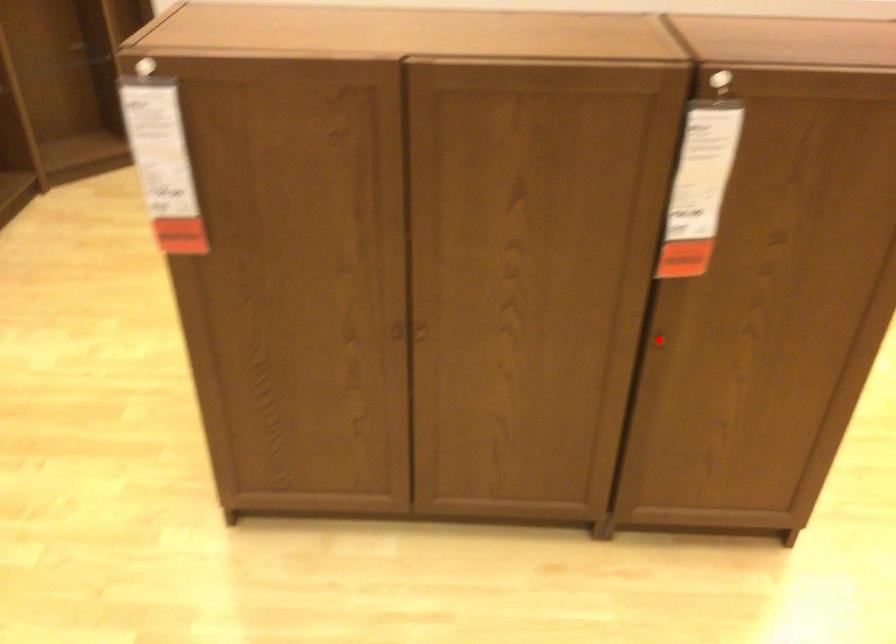
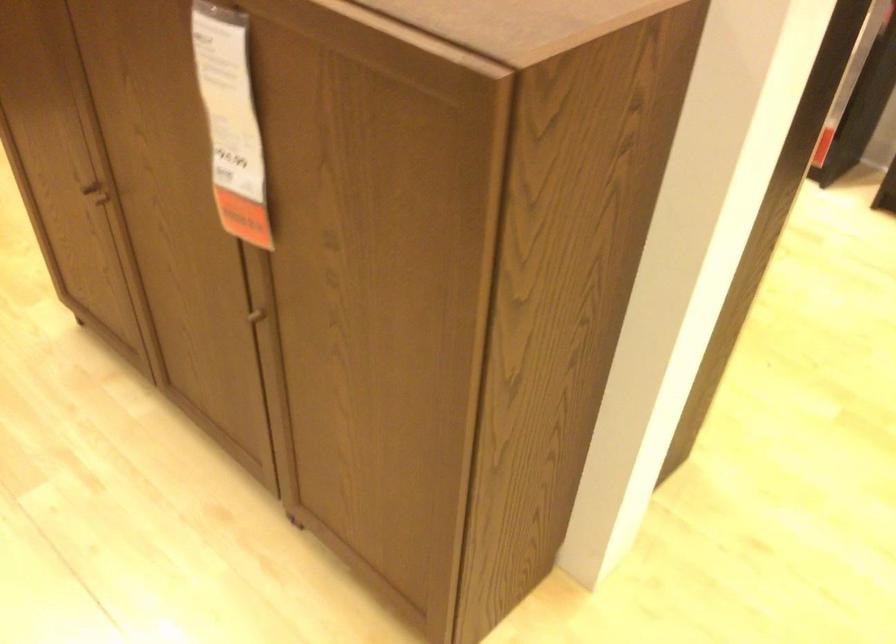
Question: I am providing you with two images of the same scene from different viewpoints. Image1 has a red point marked. In image2, the corresponding 3D location appears at what relative position? Reply with the corresponding letter.

Choices:
 (A) Closer
 (B) Farther

Answer: (A)